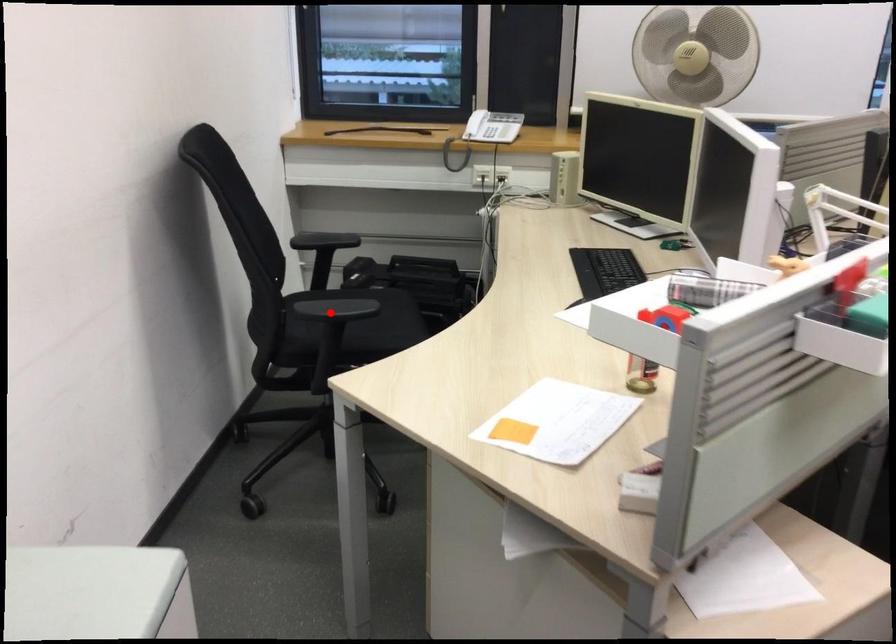
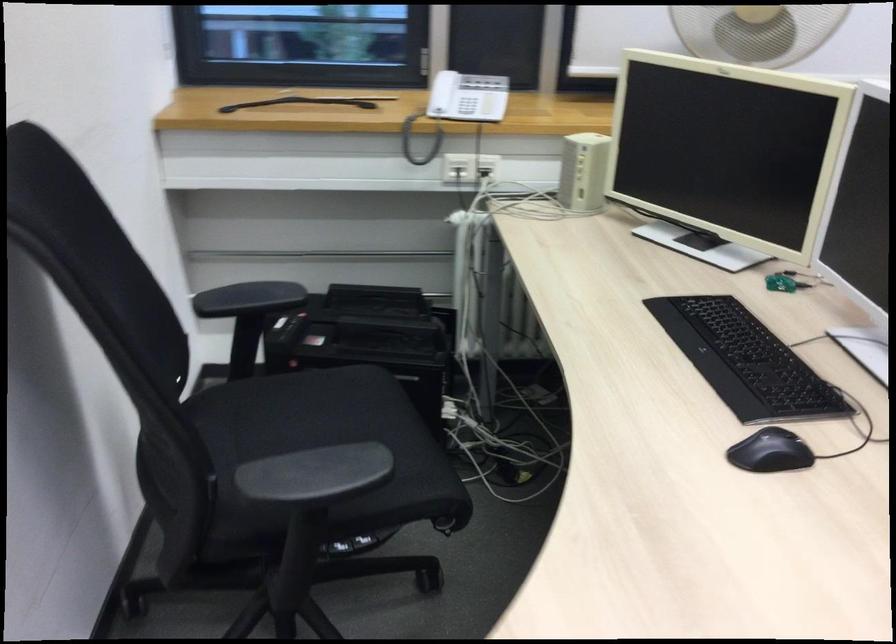
Locate, in the second image, the point that corresponds to the highlighted location in the first image.

(315, 475)